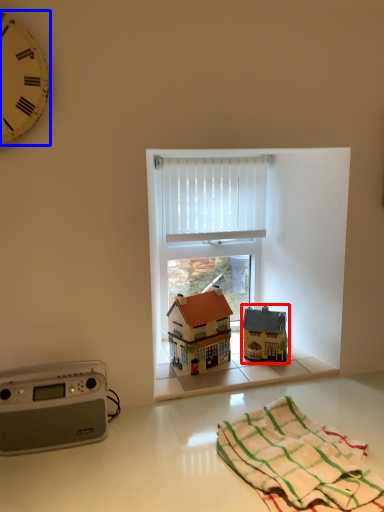
Question: Which of the following is the farthest to the observer, toy (highlighted by a red box) or clock (highlighted by a blue box)?

Choices:
 (A) toy
 (B) clock

Answer: (A)